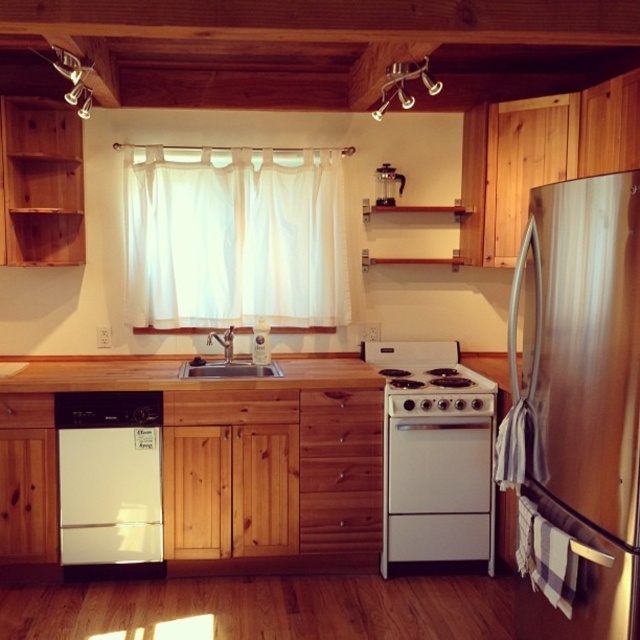
Consider the image. You are a kitchen designer and need to install a new microwave that requires a cabinet above it. The microwave needs to be placed above an appliance that is shorter than it. Given the stainless steel refrigerator at right and the brushed metal sink at center, which appliance should the microwave be placed above?

The microwave should be placed above the brushed metal sink at center because the stainless steel refrigerator at right is taller than the brushed metal sink at center, making the sink a suitable location for the microwave that requires a cabinet above it.

You are standing in the kitchen and want to reach the stainless steel refrigerator at right. Which direction should you move relative to the white sheer curtain at center?

You should move to the right of the white sheer curtain at center to reach the stainless steel refrigerator at right.